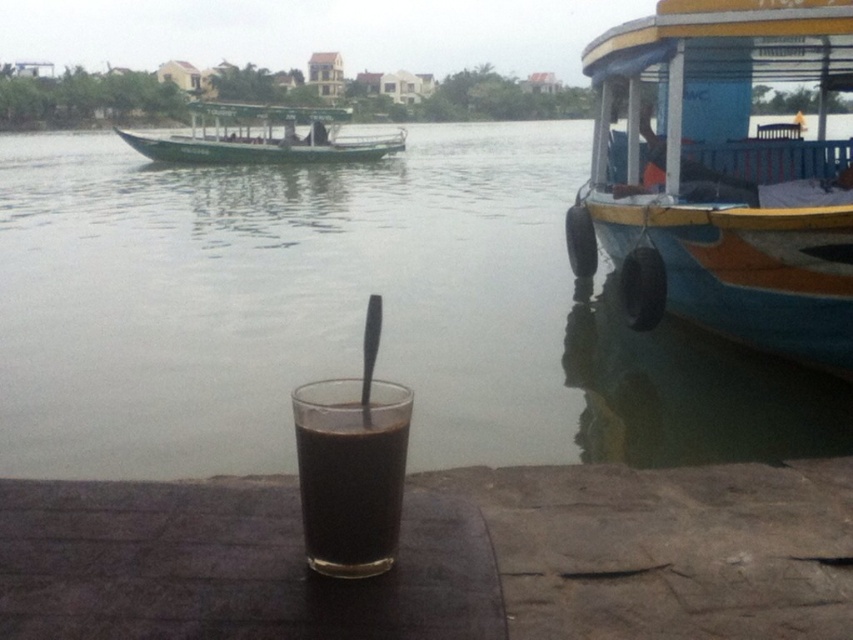
You are planning to board a boat that can accommodate 5 passengers. You see the blue painted wood boat at right and the green matte boat at upper left. Which boat has enough space to fit all 5 passengers?

The green matte boat at upper left has a wider width than the blue painted wood boat at right, so it can accommodate all 5 passengers.